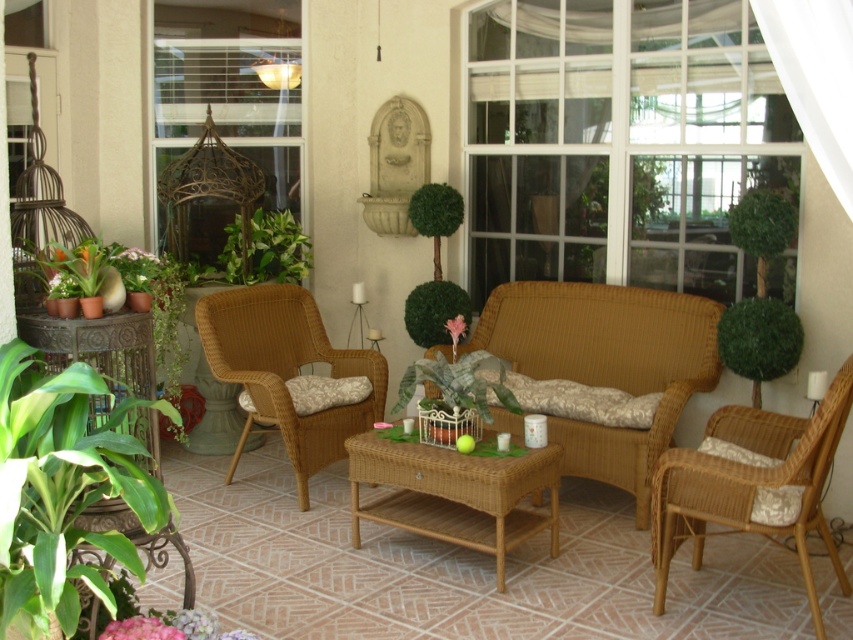
Question: Which point is closer to the camera?

Choices:
 (A) woven wicker armchair at right
 (B) woven rattan coffee table at center
 (C) green leafy bush at center
 (D) green leafy plant at center

Answer: (A)

Question: Does woven wicker couch at center appear on the left side of white sheer curtain at upper right?

Choices:
 (A) no
 (B) yes

Answer: (B)

Question: Among these points, which one is nearest to the camera?

Choices:
 (A) (329, 412)
 (B) (706, 488)
 (C) (428, 282)
 (D) (384, 461)

Answer: (B)

Question: Where is woven wicker armchair at center-left located in relation to green leafy plant at center in the image?

Choices:
 (A) above
 (B) below

Answer: (B)

Question: Is woven wicker armchair at right to the right of green wicker basket at center from the viewer's perspective?

Choices:
 (A) yes
 (B) no

Answer: (A)

Question: Which object is positioned closest to the woven wicker couch at center?

Choices:
 (A) woven rattan coffee table at center
 (B) woven wicker armchair at center-left

Answer: (A)